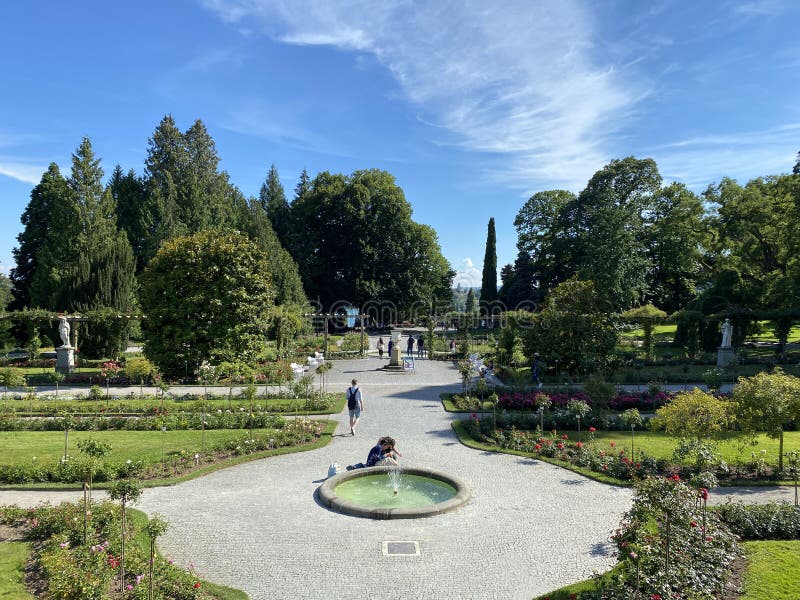
The width and height of the screenshot is (800, 600). I want to click on benches, so click(x=294, y=365), click(x=310, y=359), click(x=317, y=354), click(x=474, y=352), click(x=476, y=360), click(x=489, y=375).